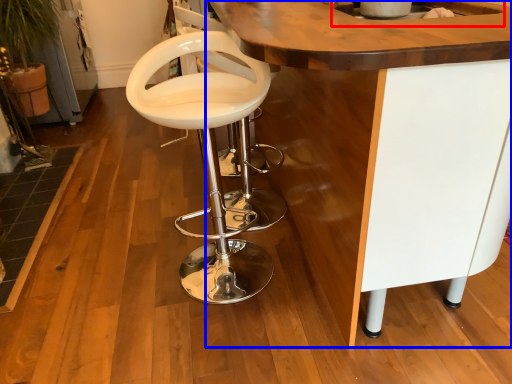
Question: Among these objects, which one is nearest to the camera, sink (highlighted by a red box) or table (highlighted by a blue box)?

Choices:
 (A) sink
 (B) table

Answer: (B)